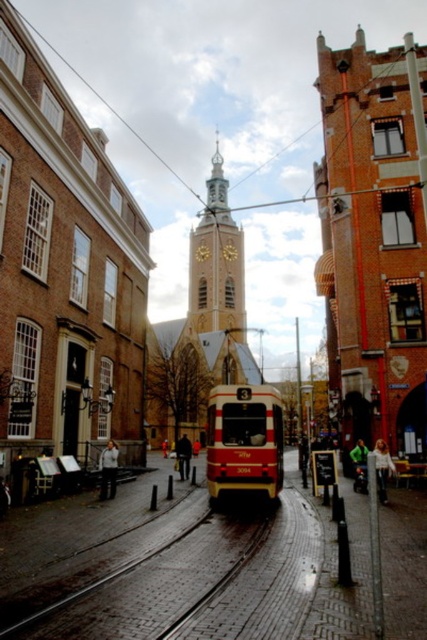
Does gold-plated spire at center have a greater width compared to brick paved train track at center?

Yes.

Which of these two, gold-plated spire at center or brick paved train track at center, stands shorter?

With less height is brick paved train track at center.

Which is behind, point (225, 237) or point (236, 570)?

The point (225, 237) is more distant.

Where is `gold-plated spire at center`? This screenshot has width=427, height=640. gold-plated spire at center is located at coordinates (216, 260).